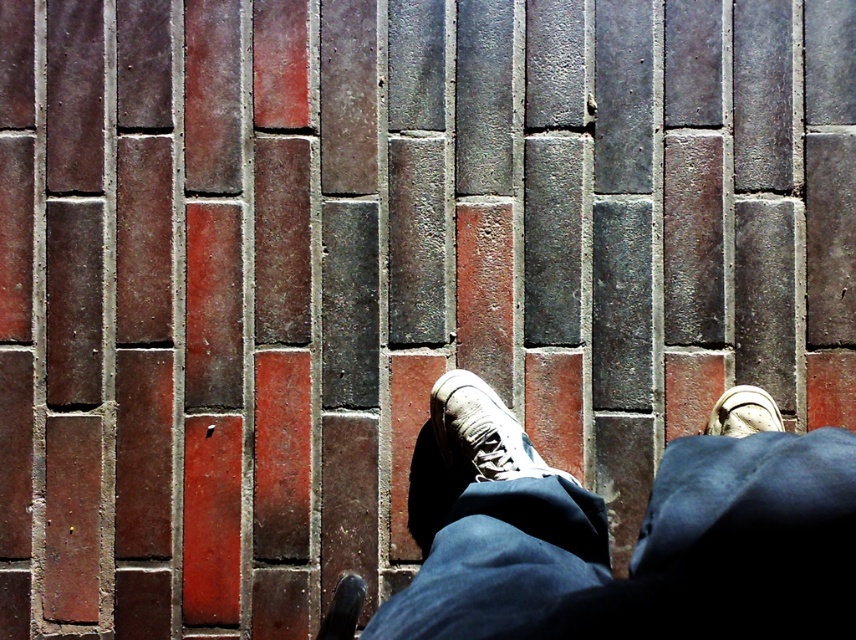
You are a photographer trying to capture the texture of the brick wall. You notice the dark blue denim jeans at center represented by point [639,548]. Where should you focus your camera to ensure the brick wall is in sharp focus while keeping the jeans in the frame?

To ensure the brick wall is in sharp focus while keeping the dark blue denim jeans at center represented by point [639,548] in the frame, focus on the brick wall itself since the jeans are part of the foreground and the wall is the main subject for texture. Adjust the aperture to a higher fstop for greater depth of field if needed.

You are a photographer setting up a shoot. You need to place a small prop between the dark blue denim jeans at center and the shiny black shoe at lower center. Based on their sizes, which object should the prop be closer to?

The prop should be placed closer to the shiny black shoe at lower center because the dark blue denim jeans at center is larger in size than the shiny black shoe at lower center, so the shoe is smaller and the prop can fit better near it.